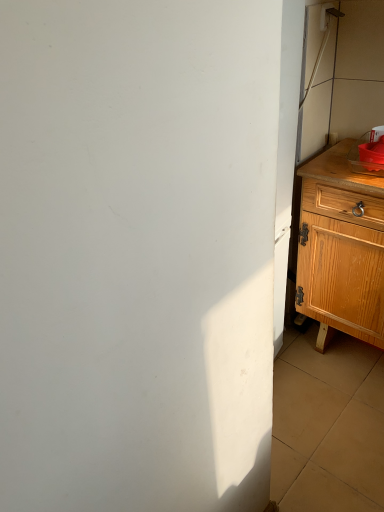
Question: Is matte plastic sink at right bigger than light brown wooden chest of drawers at right?

Choices:
 (A) yes
 (B) no

Answer: (B)

Question: From the image's perspective, is matte plastic sink at right on top of light brown wooden chest of drawers at right?

Choices:
 (A) yes
 (B) no

Answer: (A)

Question: Would you say matte plastic sink at right is a long distance from light brown wooden chest of drawers at right?

Choices:
 (A) yes
 (B) no

Answer: (B)

Question: Is matte plastic sink at right wider than light brown wooden chest of drawers at right?

Choices:
 (A) yes
 (B) no

Answer: (B)

Question: Is matte plastic sink at right next to light brown wooden chest of drawers at right and touching it?

Choices:
 (A) yes
 (B) no

Answer: (B)

Question: Could you tell me if matte plastic sink at right is facing light brown wooden chest of drawers at right?

Choices:
 (A) yes
 (B) no

Answer: (B)

Question: Is light brown wooden chest of drawers at right located outside matte plastic sink at right?

Choices:
 (A) no
 (B) yes

Answer: (B)

Question: Does light brown wooden chest of drawers at right have a lesser height compared to matte plastic sink at right?

Choices:
 (A) no
 (B) yes

Answer: (A)

Question: Is light brown wooden chest of drawers at right taller than matte plastic sink at right?

Choices:
 (A) no
 (B) yes

Answer: (B)

Question: Can you confirm if light brown wooden chest of drawers at right is smaller than matte plastic sink at right?

Choices:
 (A) no
 (B) yes

Answer: (A)

Question: Considering the relative sizes of light brown wooden chest of drawers at right and matte plastic sink at right in the image provided, is light brown wooden chest of drawers at right wider than matte plastic sink at right?

Choices:
 (A) yes
 (B) no

Answer: (A)

Question: Does light brown wooden chest of drawers at right have a larger size compared to matte plastic sink at right?

Choices:
 (A) yes
 (B) no

Answer: (A)

Question: Choose the correct answer: Is light brown wooden chest of drawers at right inside matte plastic sink at right or outside it?

Choices:
 (A) outside
 (B) inside

Answer: (A)